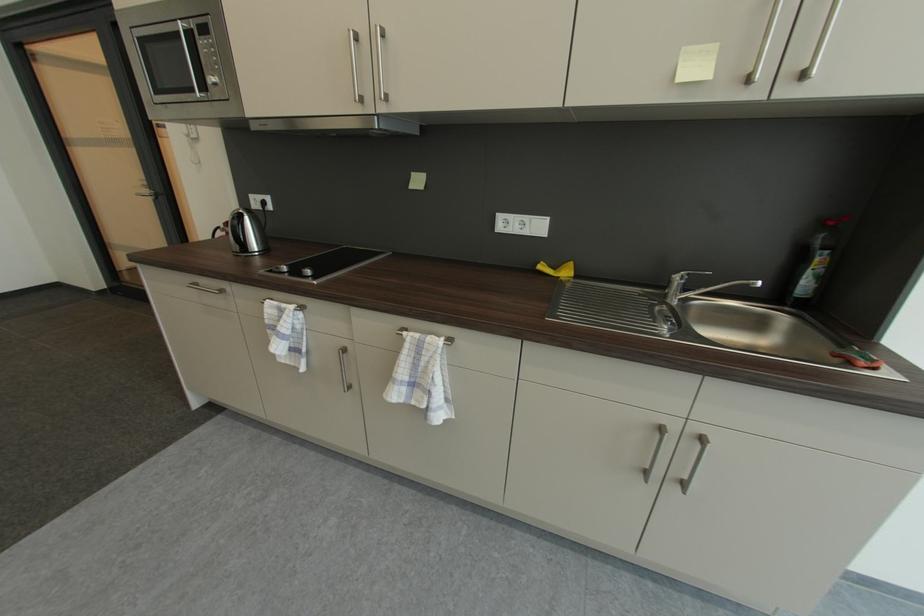
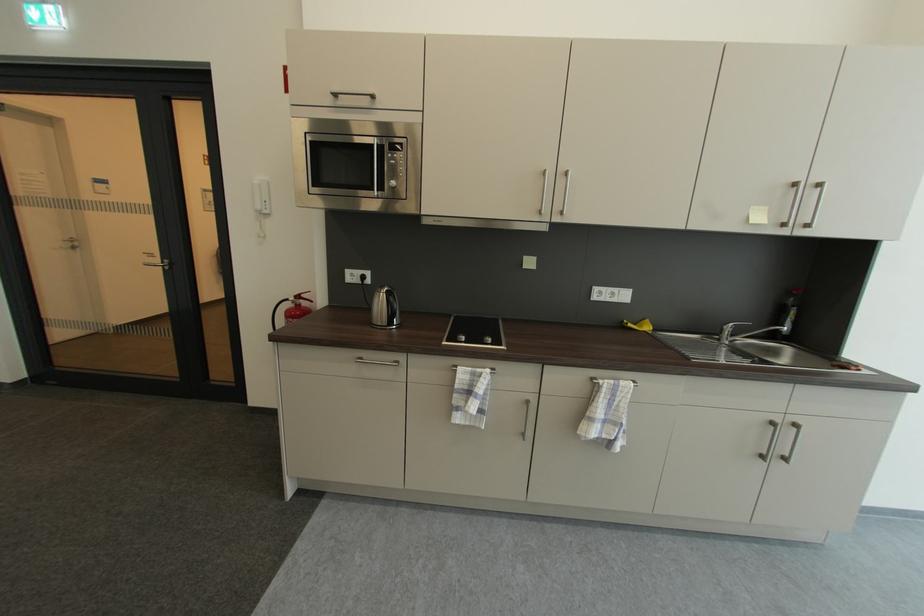
Locate, in the second image, the point that corresponds to pixel 235 225 in the first image.

(305, 299)